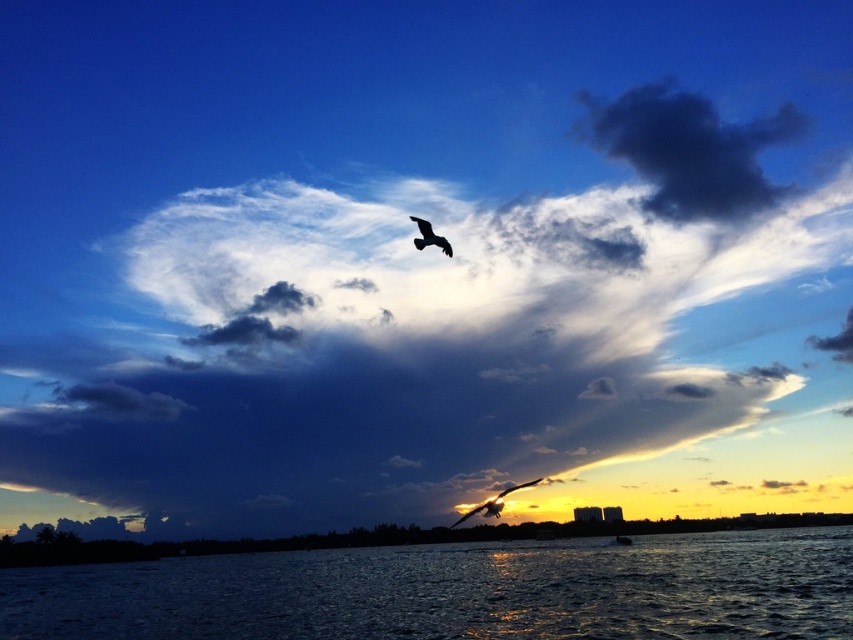
You are standing at the edge of the water in the sunset scene. There is a point labeled as point (x=457, y=592). Based on the scene description, where is this point located relative to the water?

The point (x=457, y=592) is located at the glistening dark water at lower center.

You are an astronomer analyzing the sunset scene. You notice the dark blue cloud at upper center. Can you determine its exact location in the image using coordinates?

The dark blue cloud at upper center is located at coordinates point [451,342].